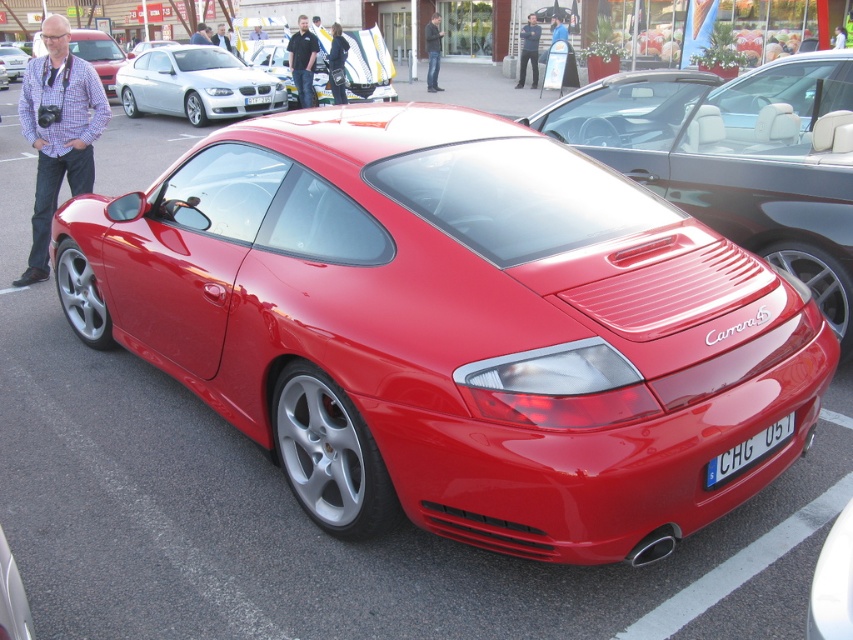
Based on the photo, who is positioned more to the left, blue metallic license plate at rear or matte black car at left?

matte black car at left

Based on the photo, between blue metallic license plate at rear and matte black car at left, which one is positioned lower?

Positioned lower is blue metallic license plate at rear.

At what (x,y) coordinates should I click in order to perform the action: click on blue metallic license plate at rear. Please return your answer as a coordinate pair (x, y). The width and height of the screenshot is (853, 640). Looking at the image, I should click on (747, 452).

Where is `blue metallic license plate at rear`? The width and height of the screenshot is (853, 640). blue metallic license plate at rear is located at coordinates (747, 452).

Can you confirm if shiny metallic red sports car at center is positioned to the right of matte black car at left?

Correct, you'll find shiny metallic red sports car at center to the right of matte black car at left.

Who is shorter, shiny metallic red sports car at center or matte black car at left?

matte black car at left is shorter.

Is point (538, 179) behind point (9, 45)?

That is False.

Identify the location of shiny metallic red sports car at center. (453, 326).

Does sleek silver coupe at upper left appear under blue metallic license plate at rear?

Incorrect, sleek silver coupe at upper left is not positioned below blue metallic license plate at rear.

Who is more forward, (171, 60) or (749, 461)?

Point (749, 461) is more forward.

The width and height of the screenshot is (853, 640). Describe the element at coordinates (196, 84) in the screenshot. I see `sleek silver coupe at upper left` at that location.

Locate an element on the screen. This screenshot has width=853, height=640. sleek silver coupe at upper left is located at coordinates (196, 84).